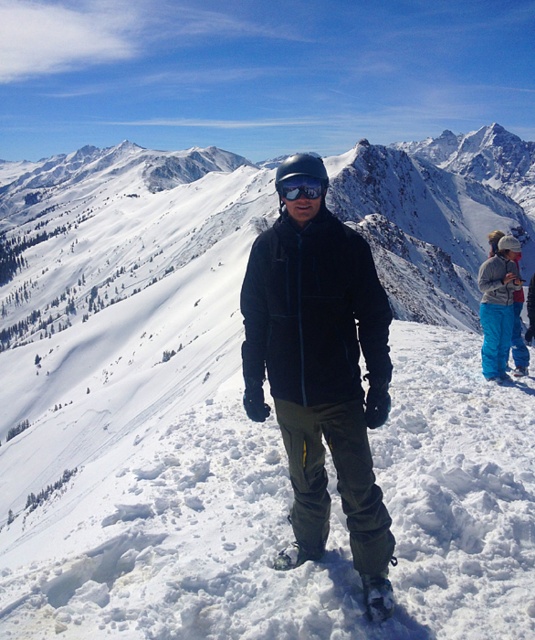
Looking at this image, you are an observer looking at the snowy mountain scene. You notice the matte black jacket at center and the matte blue snow pants at right. Which object appears higher in the image?

The matte black jacket at center appears higher in the image because it is taller than the matte blue snow pants at right.

You are a photographer trying to capture the person in the snowy landscape. You notice the matte black jacket at center and the black matte goggles at center. Which object is positioned to the left of the other?

The matte black jacket at center is to the left of the black matte goggles at center.